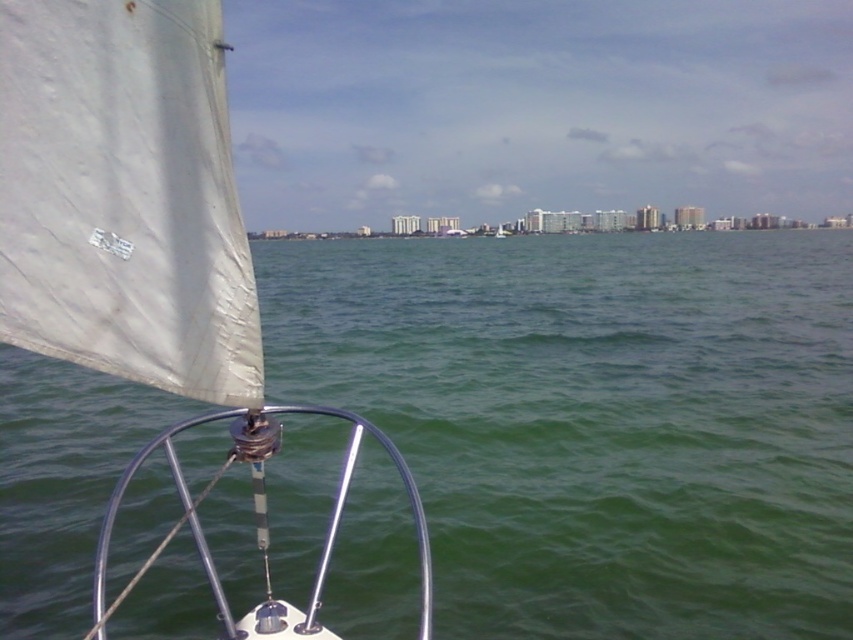
Is green water at center shorter than white matte sail at center?

No, green water at center is not shorter than white matte sail at center.

Is point (482, 449) behind point (62, 77)?

Yes, it is behind point (62, 77).

What are the coordinates of `green water at center` in the screenshot? It's located at (596, 419).